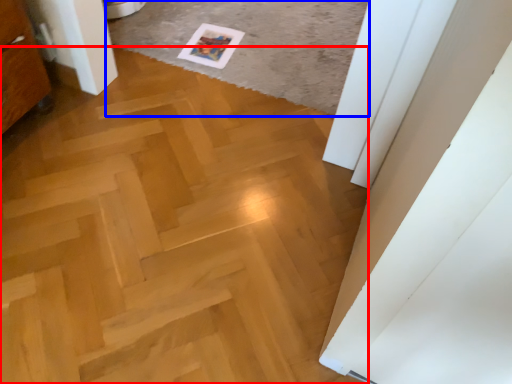
Question: Among these objects, which one is nearest to the camera, plywood (highlighted by a red box) or plain (highlighted by a blue box)?

Choices:
 (A) plywood
 (B) plain

Answer: (A)